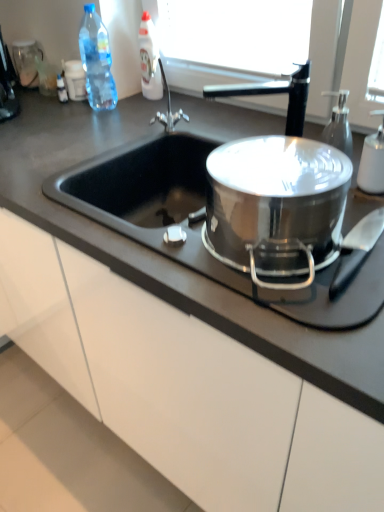
Question: From the image's perspective, is black plastic coffee machine at upper left beneath black matte countertop at center?

Choices:
 (A) no
 (B) yes

Answer: (A)

Question: Considering the relative sizes of black plastic coffee machine at upper left and black matte countertop at center in the image provided, is black plastic coffee machine at upper left bigger than black matte countertop at center?

Choices:
 (A) no
 (B) yes

Answer: (A)

Question: Is the position of black plastic coffee machine at upper left more distant than that of black matte countertop at center?

Choices:
 (A) no
 (B) yes

Answer: (B)

Question: Is black plastic coffee machine at upper left at the right side of black matte countertop at center?

Choices:
 (A) yes
 (B) no

Answer: (B)

Question: Can black matte countertop at center be found inside black plastic coffee machine at upper left?

Choices:
 (A) yes
 (B) no

Answer: (B)

Question: Is black plastic coffee machine at upper left shorter than black matte countertop at center?

Choices:
 (A) no
 (B) yes

Answer: (B)

Question: Is stainless steel pot at center positioned beyond the bounds of black plastic coffee machine at upper left?

Choices:
 (A) no
 (B) yes

Answer: (B)

Question: From a real-world perspective, is stainless steel pot at center on top of black plastic coffee machine at upper left?

Choices:
 (A) yes
 (B) no

Answer: (B)

Question: Is stainless steel pot at center directly adjacent to black plastic coffee machine at upper left?

Choices:
 (A) yes
 (B) no

Answer: (B)

Question: Is there a large distance between stainless steel pot at center and black plastic coffee machine at upper left?

Choices:
 (A) yes
 (B) no

Answer: (A)

Question: From the image's perspective, does stainless steel pot at center appear higher than black plastic coffee machine at upper left?

Choices:
 (A) no
 (B) yes

Answer: (A)

Question: Does stainless steel pot at center come behind black plastic coffee machine at upper left?

Choices:
 (A) no
 (B) yes

Answer: (A)

Question: Does white matte soap dispenser at right, the third bottle viewed from the back, come behind white glossy bottle at upper center, the 1th bottle from the top?

Choices:
 (A) no
 (B) yes

Answer: (A)